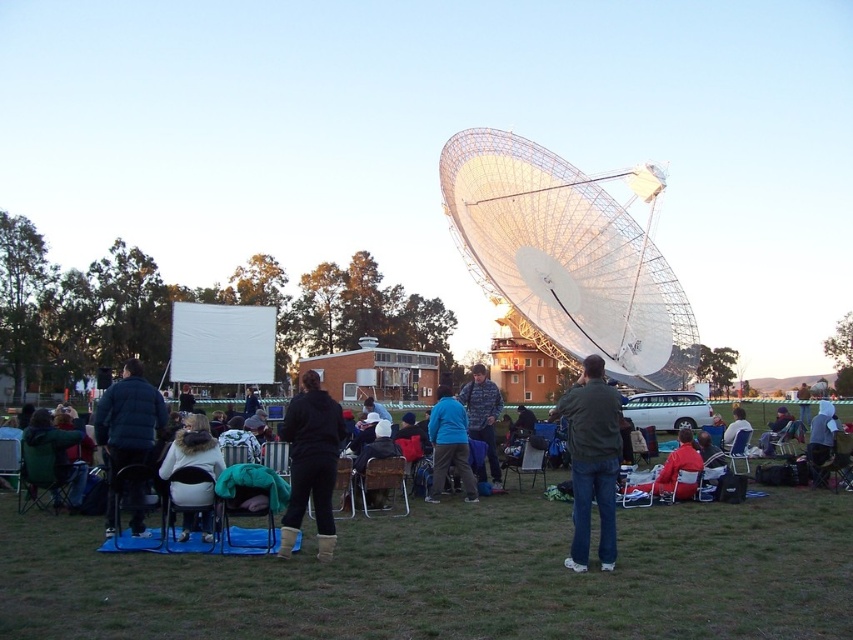
Which is more to the left, dark blue puffer jacket at left or blue fabric jacket at center?

From the viewer's perspective, dark blue puffer jacket at left appears more on the left side.

Is point (141, 376) positioned in front of point (445, 413)?

Yes, it is in front of point (445, 413).

This screenshot has height=640, width=853. Describe the element at coordinates (126, 426) in the screenshot. I see `dark blue puffer jacket at left` at that location.

This screenshot has width=853, height=640. What are the coordinates of `dark blue puffer jacket at left` in the screenshot? It's located at (126, 426).

Does blue fabric jacket at center appear over red fabric jacket at center?

Indeed, blue fabric jacket at center is positioned over red fabric jacket at center.

In the scene shown: Who is higher up, blue fabric jacket at center or red fabric jacket at center?

blue fabric jacket at center is higher up.

What do you see at coordinates (450, 444) in the screenshot?
I see `blue fabric jacket at center` at bounding box center [450, 444].

Locate an element on the screen. blue fabric jacket at center is located at coordinates (450, 444).

Can you confirm if dark blue puffer jacket at left is positioned to the left of green fabric jacket at lower left?

No, dark blue puffer jacket at left is not to the left of green fabric jacket at lower left.

Can you confirm if dark blue puffer jacket at left is positioned above green fabric jacket at lower left?

Yes, dark blue puffer jacket at left is above green fabric jacket at lower left.

Is point (125, 387) closer to camera compared to point (74, 483)?

Yes, point (125, 387) is closer to viewer.

Where is `dark blue puffer jacket at left`? Image resolution: width=853 pixels, height=640 pixels. dark blue puffer jacket at left is located at coordinates (126, 426).